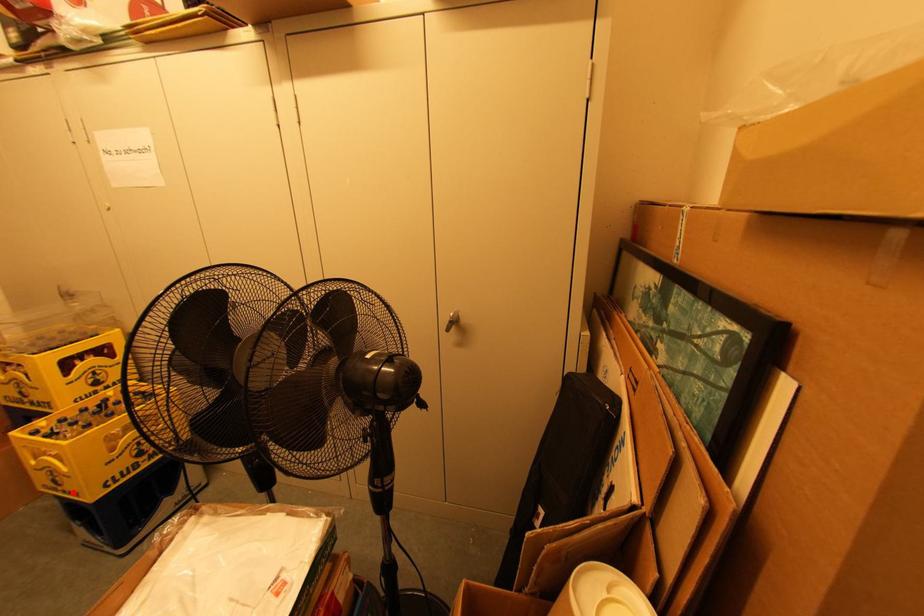
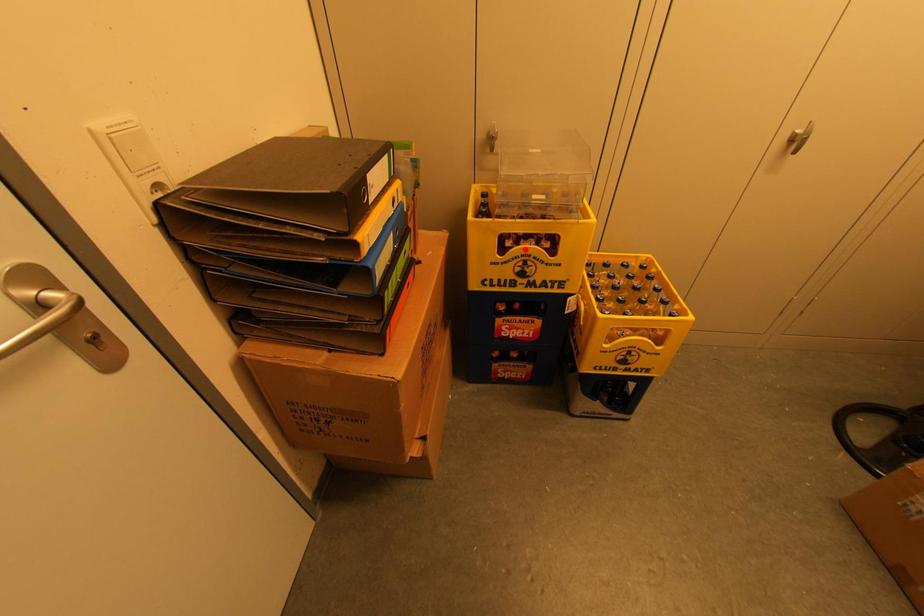
I am providing you with two images of the same scene from different viewpoints. A red point is marked on the first image and another point is marked on the second image. Are the points marked in image1 and image2 representing the same 3D position?

No